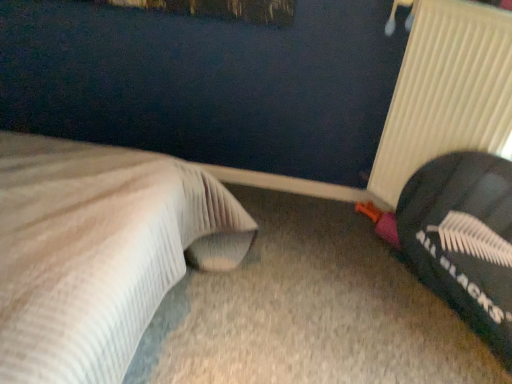
Question: From the image's perspective, is white ribbed radiator at right positioned above or below white textured bed at left?

Choices:
 (A) above
 (B) below

Answer: (A)

Question: From a real-world perspective, is white ribbed radiator at right positioned above or below white textured bed at left?

Choices:
 (A) above
 (B) below

Answer: (A)

Question: Considering the real-world distances, which object is farthest from the white textured bed at left?

Choices:
 (A) black fabric bean bag at right
 (B) white ribbed radiator at right

Answer: (B)

Question: Which object is the closest to the white ribbed radiator at right?

Choices:
 (A) white textured bed at left
 (B) black fabric bean bag at right

Answer: (B)